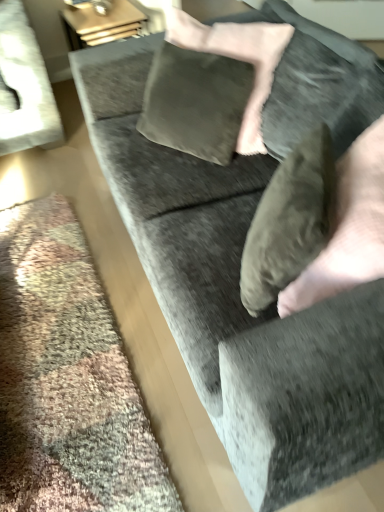
Question: From the image's perspective, is velvet gray pillow at center located beneath suede-like tan hand at lower right?

Choices:
 (A) yes
 (B) no

Answer: (B)

Question: Is velvet gray pillow at center in front of suede-like tan hand at lower right?

Choices:
 (A) yes
 (B) no

Answer: (B)

Question: Can you confirm if velvet gray pillow at center is smaller than suede-like tan hand at lower right?

Choices:
 (A) no
 (B) yes

Answer: (B)

Question: Is velvet gray pillow at center placed right next to suede-like tan hand at lower right?

Choices:
 (A) yes
 (B) no

Answer: (A)

Question: Is velvet gray pillow at center located outside suede-like tan hand at lower right?

Choices:
 (A) no
 (B) yes

Answer: (A)

Question: Does velvet gray pillow at center have a greater height compared to suede-like tan hand at lower right?

Choices:
 (A) yes
 (B) no

Answer: (B)

Question: Is suede-like tan hand at lower right at the left side of velvet gray pillow at center?

Choices:
 (A) yes
 (B) no

Answer: (B)

Question: Are suede-like tan hand at lower right and velvet gray pillow at center located far from each other?

Choices:
 (A) yes
 (B) no

Answer: (B)

Question: Would you say suede-like tan hand at lower right is outside velvet gray pillow at center?

Choices:
 (A) no
 (B) yes

Answer: (B)

Question: From a real-world perspective, is suede-like tan hand at lower right positioned under velvet gray pillow at center based on gravity?

Choices:
 (A) no
 (B) yes

Answer: (B)

Question: Is suede-like tan hand at lower right to the right of velvet gray pillow at center from the viewer's perspective?

Choices:
 (A) no
 (B) yes

Answer: (B)

Question: Can you confirm if suede-like tan hand at lower right is taller than velvet gray pillow at center?

Choices:
 (A) yes
 (B) no

Answer: (A)

Question: Is velvet gray pillow at center wider or thinner than suede-like tan hand at lower right?

Choices:
 (A) wide
 (B) thin

Answer: (B)